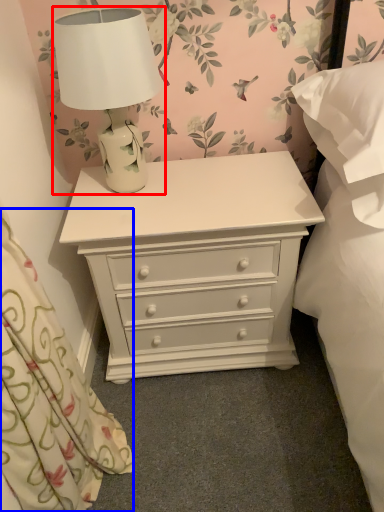
Question: Which point is closer to the camera, lamp (highlighted by a red box) or curtain (highlighted by a blue box)?

Choices:
 (A) lamp
 (B) curtain

Answer: (B)